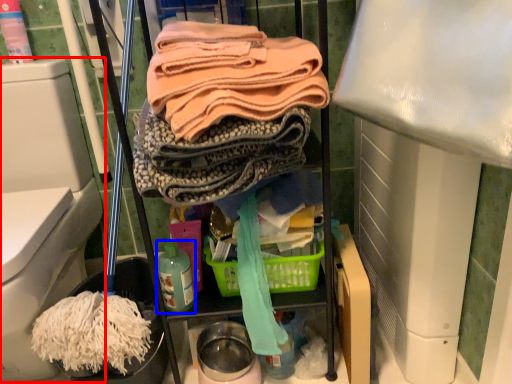
Question: Which object appears farthest to the camera in this image, bidet (highlighted by a red box) or bottle (highlighted by a blue box)?

Choices:
 (A) bidet
 (B) bottle

Answer: (B)